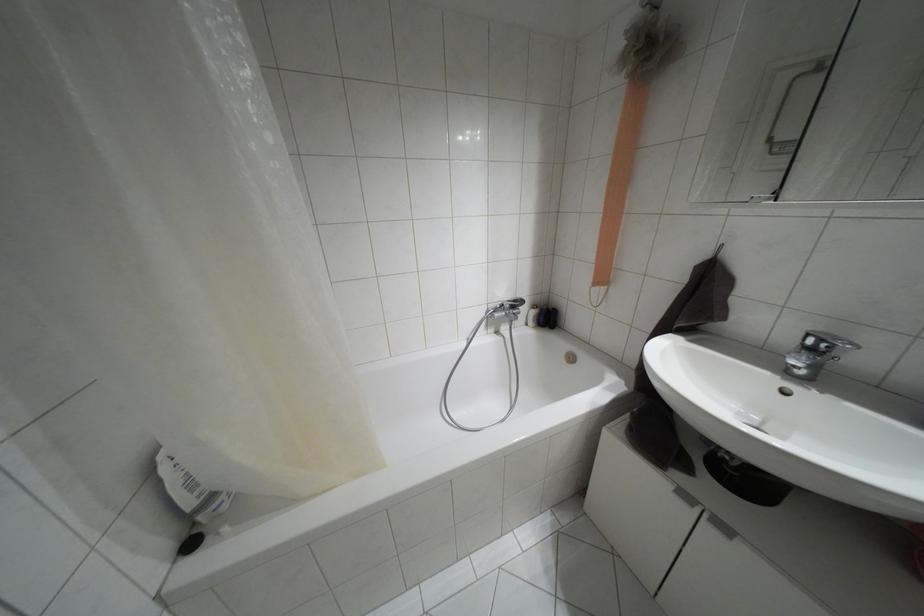
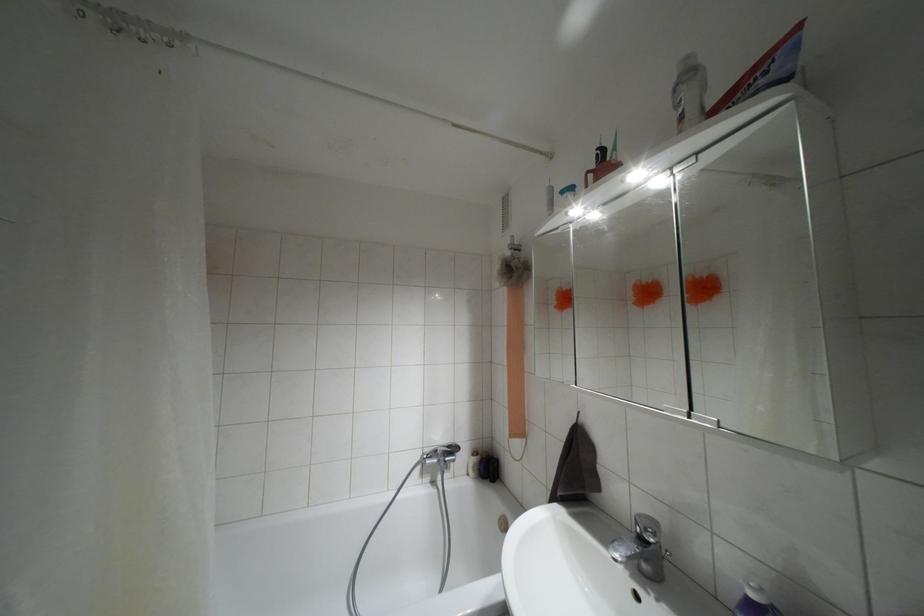
Locate, in the second image, the point that corresponds to pixel 648 58 in the first image.

(509, 277)